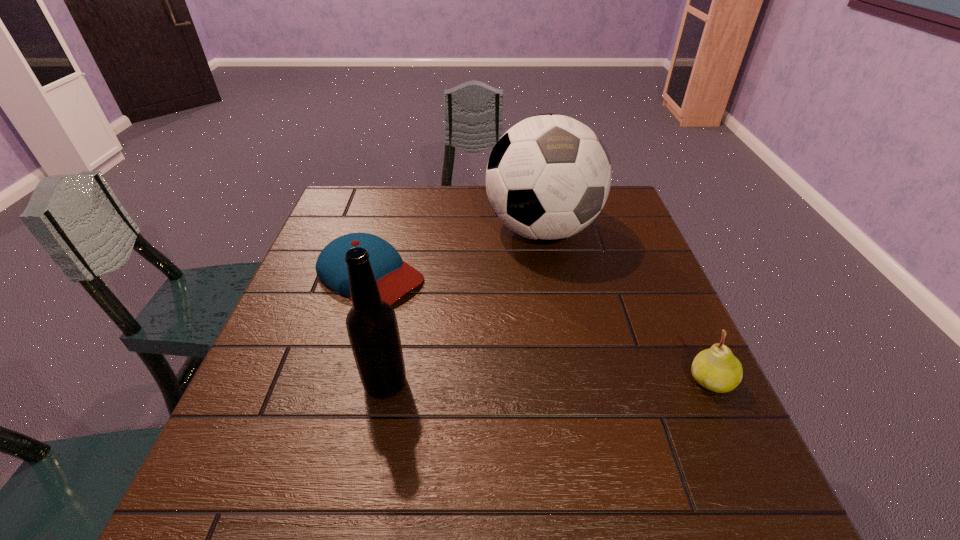
In the image, there is a desktop. At what (x,y) coordinates should I click in order to perform the action: click on vacant space at the left edge. Please return your answer as a coordinate pair (x, y). This screenshot has width=960, height=540. Looking at the image, I should click on (271, 400).

In order to click on free spot at the right edge of the desktop in this screenshot , I will do `click(654, 382)`.

Find the location of a particular element. vacant space at the far left corner of the desktop is located at coordinates (353, 204).

Locate an element on the screen. free location at the near left corner is located at coordinates (243, 411).

At what (x,y) coordinates should I click in order to perform the action: click on free space at the far right corner. Please return your answer as a coordinate pair (x, y). Looking at the image, I should click on (618, 214).

Locate an element on the screen. Image resolution: width=960 pixels, height=540 pixels. vacant space at the near right corner is located at coordinates (660, 447).

Identify the location of vacant area that lies between the pear and the shortest object. (540, 328).

At what (x,y) coordinates should I click in order to perform the action: click on vacant area between the soccer ball and the baseball cap. Please return your answer as a coordinate pair (x, y). Looking at the image, I should click on (456, 253).

The height and width of the screenshot is (540, 960). What are the coordinates of `vacant space that's between the pear and the beer bottle` in the screenshot? It's located at (548, 382).

Where is `free space between the third object from left to right and the second shortest object`? This screenshot has height=540, width=960. free space between the third object from left to right and the second shortest object is located at coordinates (626, 306).